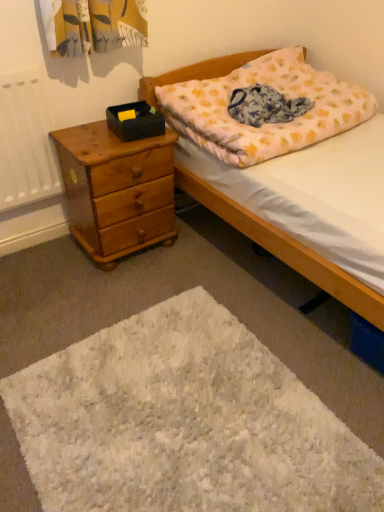
Question: Does white fluffy mat at lower center appear on the left side of light brown wooden chest of drawers at left?

Choices:
 (A) no
 (B) yes

Answer: (A)

Question: From a real-world perspective, is white fluffy mat at lower center on light brown wooden chest of drawers at left?

Choices:
 (A) no
 (B) yes

Answer: (A)

Question: Can you confirm if white fluffy mat at lower center is positioned to the right of light brown wooden chest of drawers at left?

Choices:
 (A) no
 (B) yes

Answer: (B)

Question: Is white fluffy mat at lower center outside light brown wooden chest of drawers at left?

Choices:
 (A) yes
 (B) no

Answer: (A)

Question: From the image's perspective, is white fluffy mat at lower center on light brown wooden chest of drawers at left?

Choices:
 (A) no
 (B) yes

Answer: (A)

Question: Looking at their shapes, would you say white fluffy mat at lower center is wider or thinner than light brown wooden chest of drawers at left?

Choices:
 (A) thin
 (B) wide

Answer: (B)

Question: Based on their sizes in the image, would you say white fluffy mat at lower center is bigger or smaller than light brown wooden chest of drawers at left?

Choices:
 (A) big
 (B) small

Answer: (B)

Question: Does point (117, 449) appear closer or farther from the camera than point (147, 167)?

Choices:
 (A) closer
 (B) farther

Answer: (A)

Question: In terms of height, does white fluffy mat at lower center look taller or shorter compared to light brown wooden chest of drawers at left?

Choices:
 (A) short
 (B) tall

Answer: (A)

Question: Is floral cotton blanket at center bigger or smaller than white fluffy mat at lower center?

Choices:
 (A) big
 (B) small

Answer: (B)

Question: From the image's perspective, is floral cotton blanket at center located above or below white fluffy mat at lower center?

Choices:
 (A) above
 (B) below

Answer: (A)

Question: Is point (311, 105) positioned closer to the camera than point (52, 480)?

Choices:
 (A) closer
 (B) farther

Answer: (B)

Question: Is floral cotton blanket at center taller or shorter than white fluffy mat at lower center?

Choices:
 (A) short
 (B) tall

Answer: (B)

Question: In terms of height, does fluffy cotton pillow at upper right look taller or shorter compared to floral cotton blanket at center?

Choices:
 (A) short
 (B) tall

Answer: (B)

Question: From a real-world perspective, relative to floral cotton blanket at center, is fluffy cotton pillow at upper right vertically above or below?

Choices:
 (A) below
 (B) above

Answer: (A)